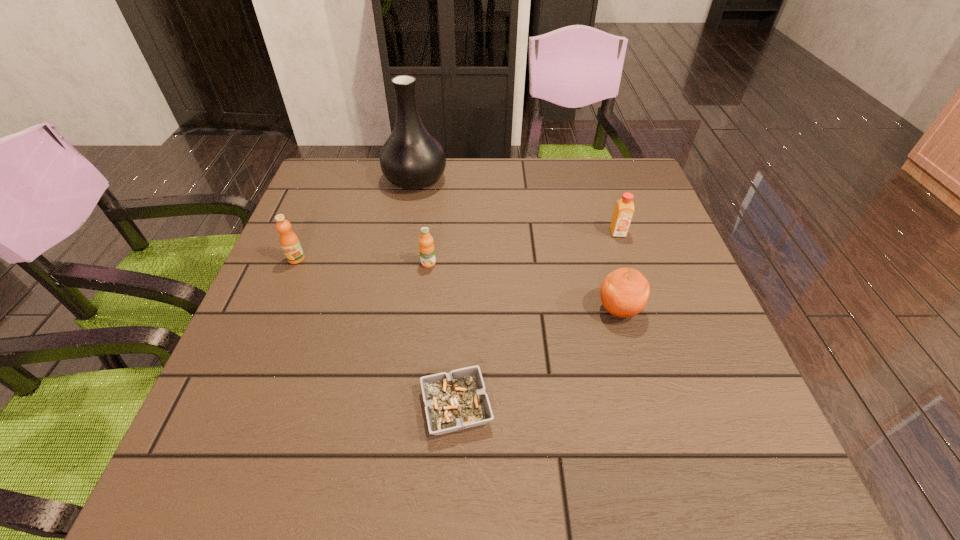
Find the location of a particular element. Image resolution: width=960 pixels, height=540 pixels. vase is located at coordinates (412, 158).

Image resolution: width=960 pixels, height=540 pixels. Find the location of `the tallest object`. the tallest object is located at coordinates (412, 158).

Find the location of `the leftmost orange juice`. the leftmost orange juice is located at coordinates tap(289, 241).

Where is `the rightmost orange juice`? The image size is (960, 540). the rightmost orange juice is located at coordinates (624, 208).

Find the location of a particular element. the farthest orange juice is located at coordinates (624, 208).

Image resolution: width=960 pixels, height=540 pixels. Identify the location of the second nearest object. (624, 293).

The height and width of the screenshot is (540, 960). I want to click on the second orange juice from right to left, so click(x=426, y=247).

Find the location of a particular element. the shortest object is located at coordinates (457, 400).

The height and width of the screenshot is (540, 960). I want to click on the nearest object, so click(457, 400).

This screenshot has height=540, width=960. In order to click on blank space located 0.160m on the left of the farthest object in this screenshot , I will do coord(328,179).